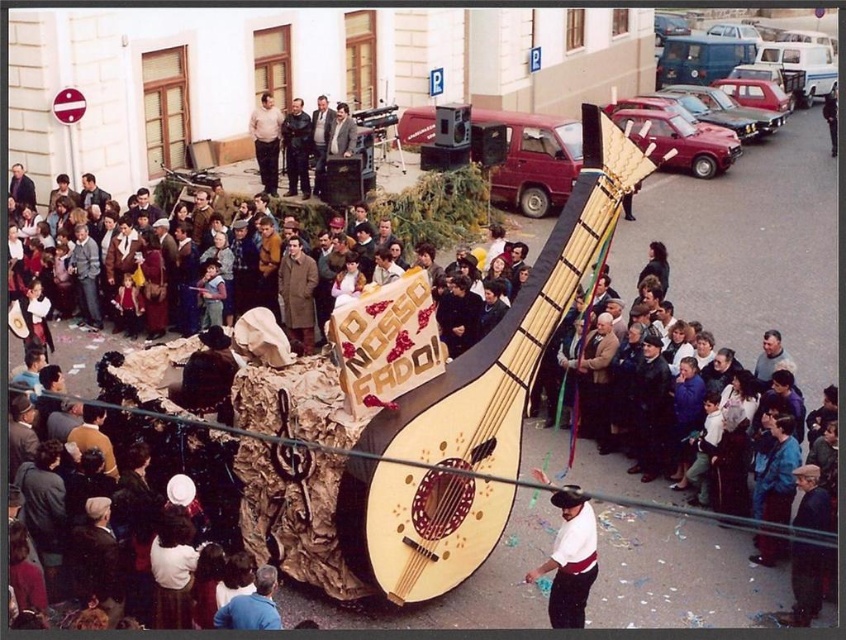
Question: Which object is the closest to the light brown leather jacket at upper center?

Choices:
 (A) wooden lute at center
 (B) white cotton shirt at lower center

Answer: (A)

Question: Is light brown leather jacket at upper center positioned in front of dark blue uniform at upper center?

Choices:
 (A) yes
 (B) no

Answer: (A)

Question: Which point is farther to the camera?

Choices:
 (A) (290, 124)
 (B) (268, 177)

Answer: (A)

Question: Among these points, which one is nearest to the camera?

Choices:
 (A) (497, 490)
 (B) (290, 170)

Answer: (A)

Question: Does white cotton shirt at lower center come behind light brown leather jacket at upper center?

Choices:
 (A) no
 (B) yes

Answer: (A)

Question: Does light brown leather jacket at upper center appear on the left side of dark blue uniform at upper center?

Choices:
 (A) no
 (B) yes

Answer: (B)